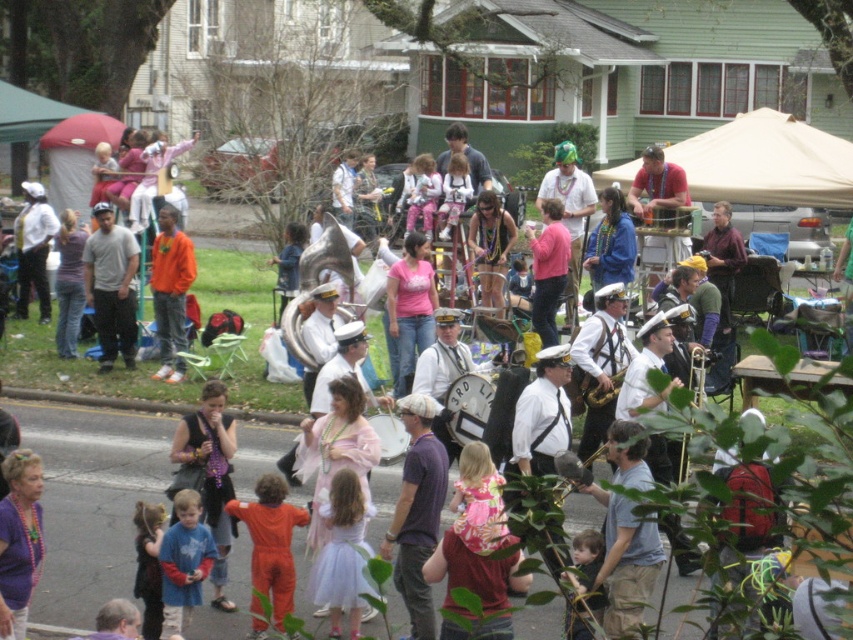
You are a participant in the parade and want to stay dry under the beige fabric canopy at center. Can you stand directly under the blue cotton shirt at center to stay dry?

The beige fabric canopy at center is positioned over the blue cotton shirt at center, so standing directly under the blue cotton shirt at center would place you under the canopy, keeping you dry.

What color is the object located at the coordinates point (170, 291) in the image?

The object at point (170, 291) is an orange matte shirt at center.